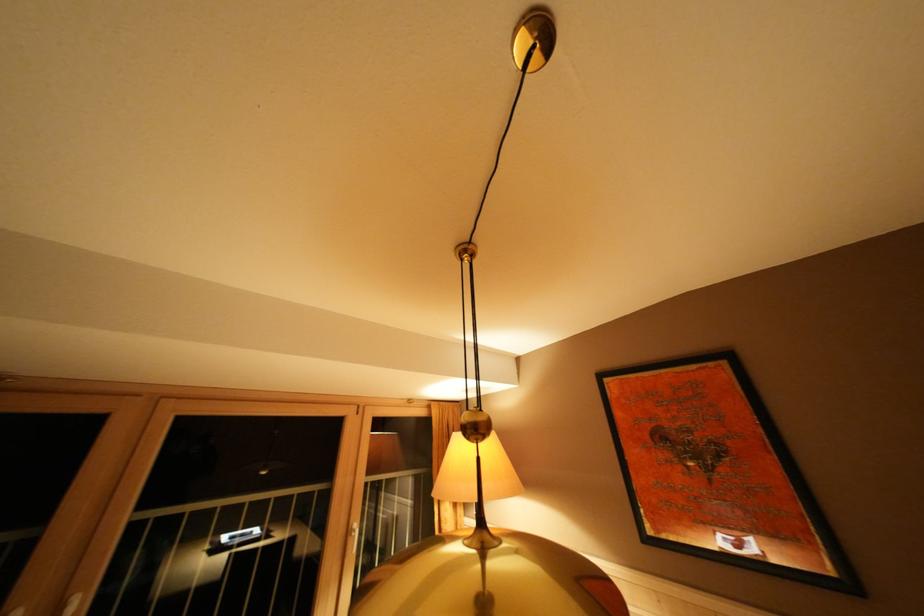
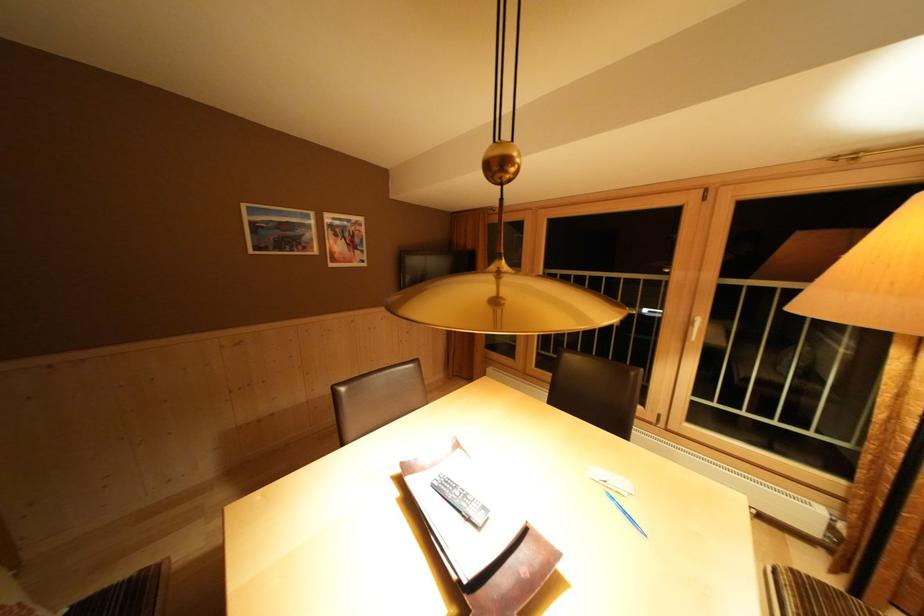
The point at (355, 537) is marked in the first image. Where is the corresponding point in the second image?

(697, 328)